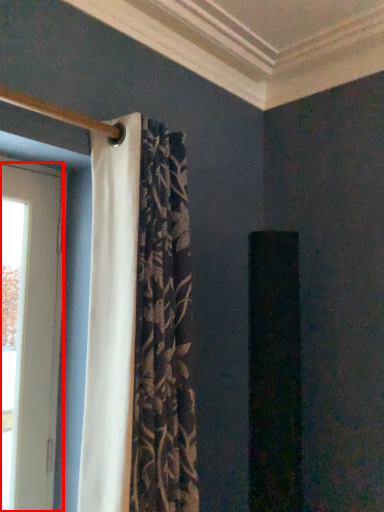
Question: From the image's perspective, what is the correct spatial relationship of door (annotated by the red box) in relation to curtain?

Choices:
 (A) below
 (B) above

Answer: (A)